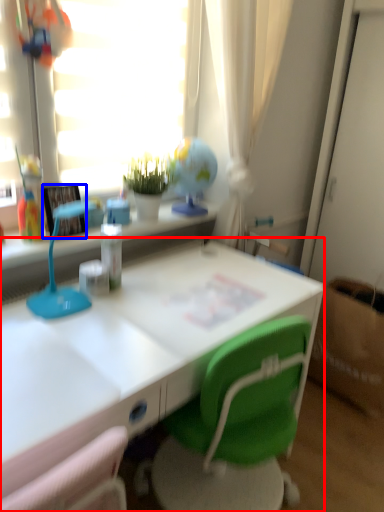
Question: Which object appears farthest to the camera in this image, desk (highlighted by a red box) or picture frame (highlighted by a blue box)?

Choices:
 (A) desk
 (B) picture frame

Answer: (B)